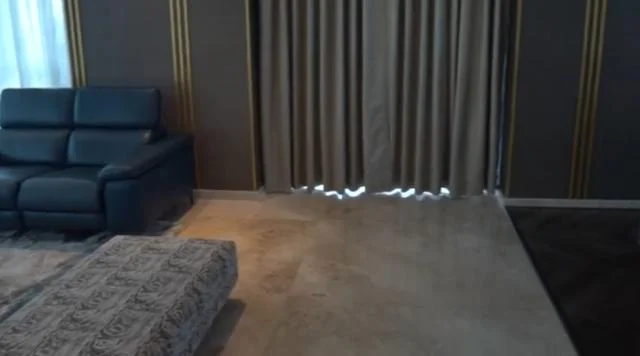
In order to click on left recliner in this screenshot , I will do `click(72, 222)`.